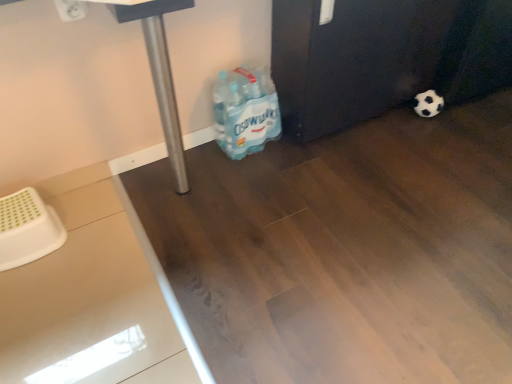
The height and width of the screenshot is (384, 512). Identify the location of vacant space to the right of black and white textured football at lower right. (466, 110).